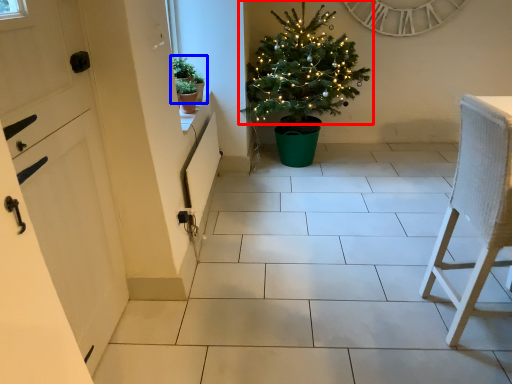
Question: Which point is closer to the camera, christmas tree (highlighted by a red box) or houseplant (highlighted by a blue box)?

Choices:
 (A) christmas tree
 (B) houseplant

Answer: (B)